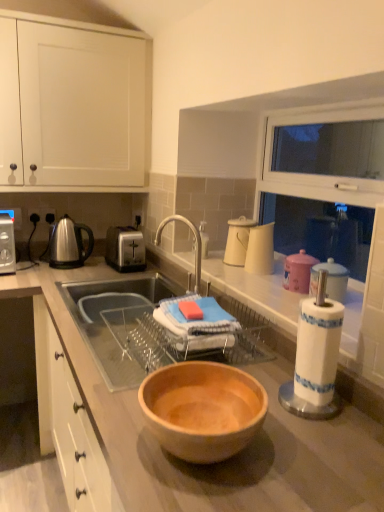
Question: Is point (120, 256) positioned closer to the camera than point (36, 285)?

Choices:
 (A) farther
 (B) closer

Answer: (A)

Question: Based on their sizes in the image, would you say satin silver toaster at center is bigger or smaller than wooden bowl at center?

Choices:
 (A) small
 (B) big

Answer: (A)

Question: Which of these objects is positioned closest to the white matte cabinet at upper right, placed as the 1th cabinetry when sorted from right to left?

Choices:
 (A) shiny metallic kettle at left
 (B) white glossy pitcher at upper right, which appears as the second appliance when viewed from the front
 (C) white paper towel holder at right, arranged as the first appliance when viewed from the front
 (D) satin silver toaster at center
 (E) wooden bowl at center

Answer: (B)

Question: Which is nearer to the white paper towel holder at right, the third appliance in the back-to-front sequence?

Choices:
 (A) white glossy cups at upper center, placed as the 3th appliance when sorted from front to back
 (B) wooden bowl at center
 (C) satin silver toaster at center
 (D) white matte cabinet at upper right, placed as the 1th cabinetry when sorted from right to left
 (E) white glossy pitcher at upper right, which is counted as the 2th appliance, starting from the back

Answer: (E)